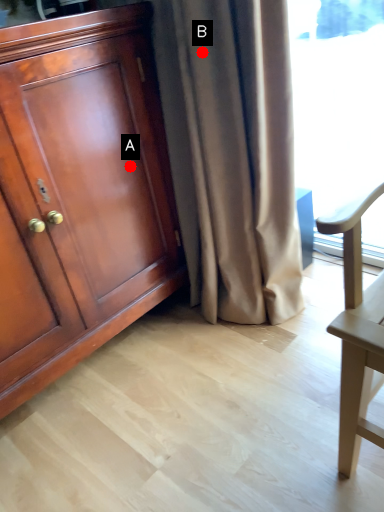
Question: Two points are circled on the image, labeled by A and B beside each circle. Which point is further to the camera?

Choices:
 (A) A is further
 (B) B is further

Answer: (A)